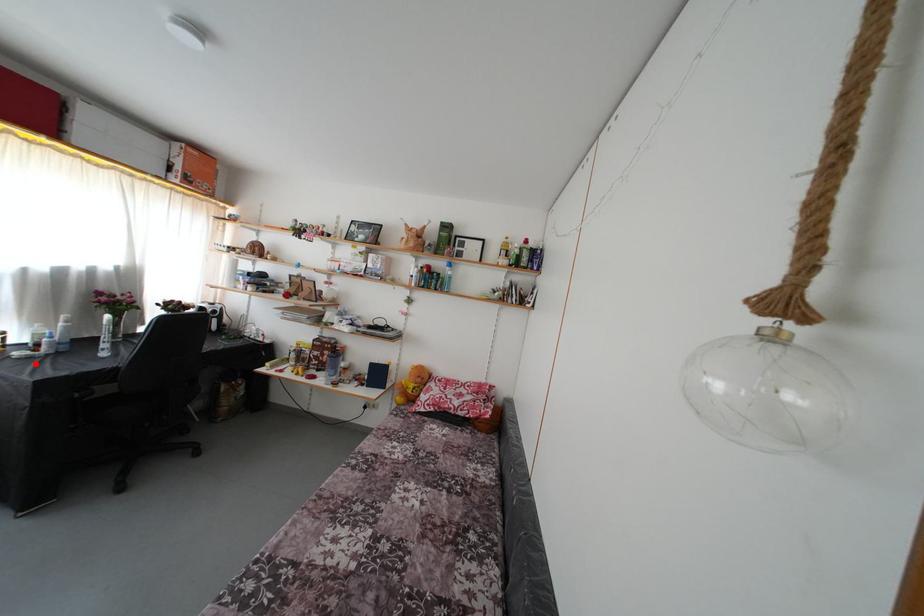
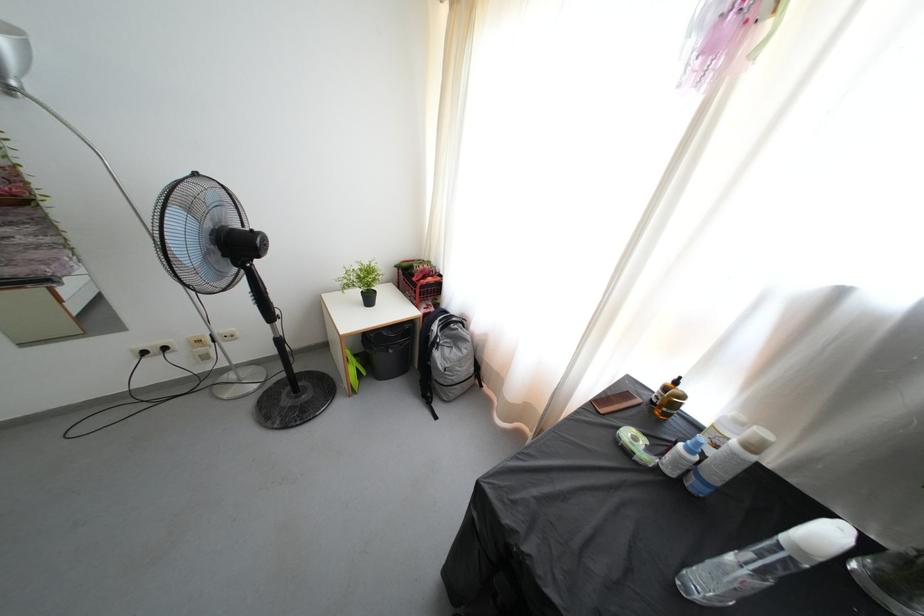
Locate, in the second image, the point that corresponds to the highlighted location in the first image.

(631, 458)